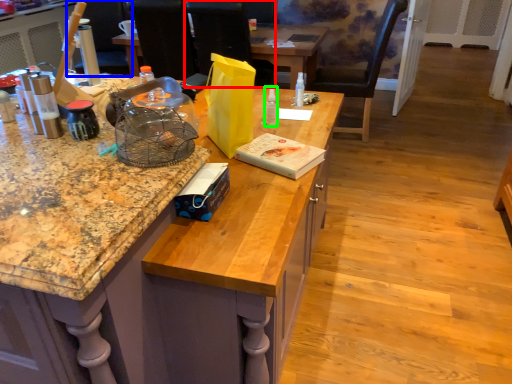
Question: Based on their relative distances, which object is farther from armchair (highlighted by a red box)? Choose from armchair (highlighted by a blue box) and bottle (highlighted by a green box).

Choices:
 (A) armchair
 (B) bottle

Answer: (B)